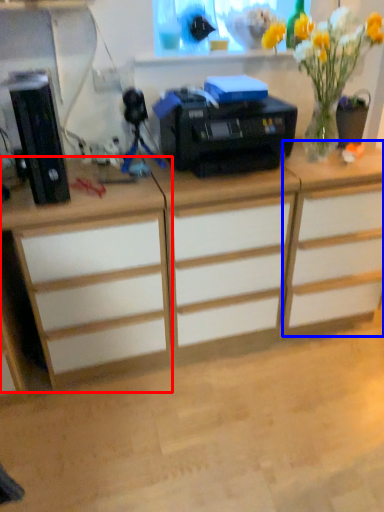
Question: Which object appears closest to the camera in this image, desk (highlighted by a red box) or cabinetry (highlighted by a blue box)?

Choices:
 (A) desk
 (B) cabinetry

Answer: (A)